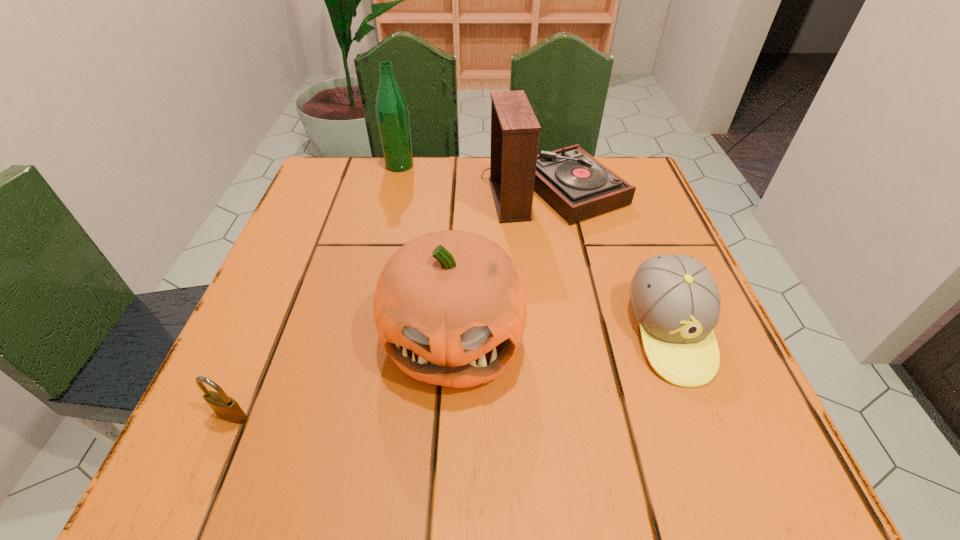
Identify the location of free space located 0.140m on the right of the padlock. (354, 416).

Locate an element on the screen. bottle that is at the far edge is located at coordinates (391, 108).

This screenshot has height=540, width=960. Identify the location of phonograph record that is at the far edge. (578, 186).

Find the location of a particular element. This screenshot has width=960, height=540. object located in the near edge section of the desktop is located at coordinates (227, 408).

You are a GUI agent. You are given a task and a screenshot of the screen. Output one action in this format:
    pyautogui.click(x=<x>, y=<y>)
    Task: Click on the bottle located in the left edge section of the desktop
    The image size is (960, 540).
    Given the screenshot: What is the action you would take?
    pyautogui.click(x=391, y=108)

Identify the location of padlock located in the left edge section of the desktop. (227, 408).

This screenshot has width=960, height=540. I want to click on phonograph record that is at the right edge, so click(578, 186).

Locate an element on the screen. This screenshot has width=960, height=540. baseball cap present at the right edge is located at coordinates (675, 299).

Where is `object located in the far left corner section of the desktop`? object located in the far left corner section of the desktop is located at coordinates (391, 108).

This screenshot has height=540, width=960. In order to click on object present at the near left corner in this screenshot , I will do `click(227, 408)`.